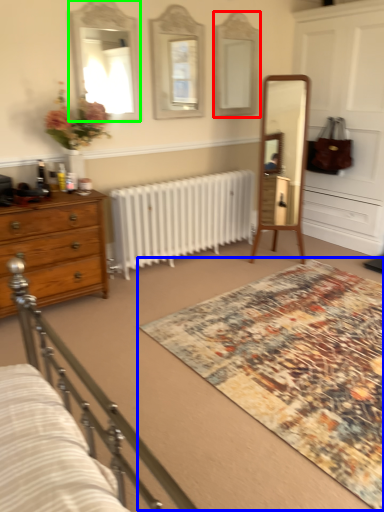
Question: Estimate the real-world distances between objects in this image. Which object is closer to mirror (highlighted by a red box), mat (highlighted by a blue box) or mirror (highlighted by a green box)?

Choices:
 (A) mat
 (B) mirror

Answer: (B)